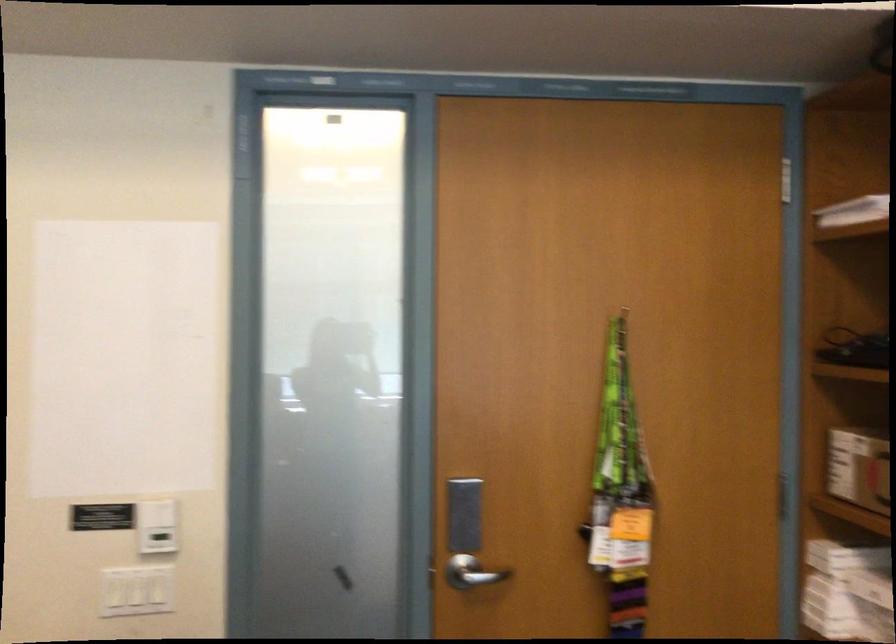
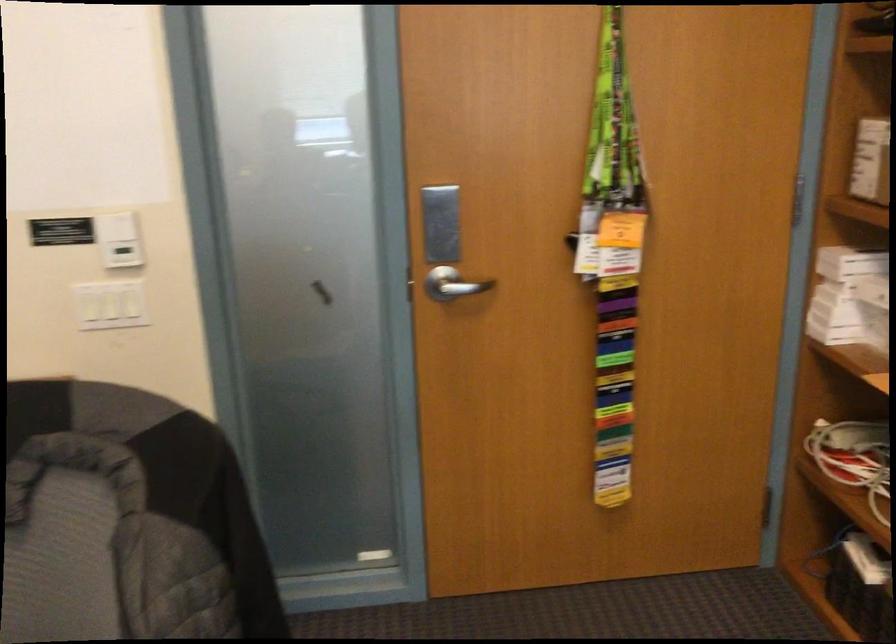
In the second image, find the point that corresponds to point 474,573 in the first image.

(452, 283)